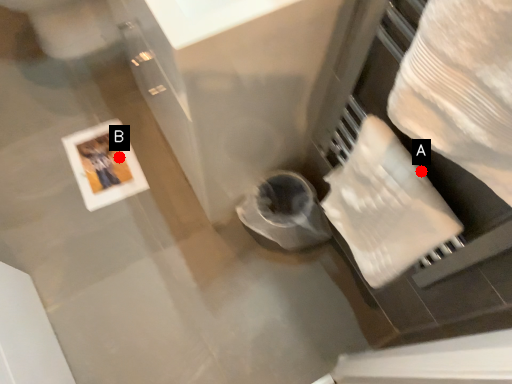
Question: Two points are circled on the image, labeled by A and B beside each circle. Among these points, which one is nearest to the camera?

Choices:
 (A) A is closer
 (B) B is closer

Answer: (A)